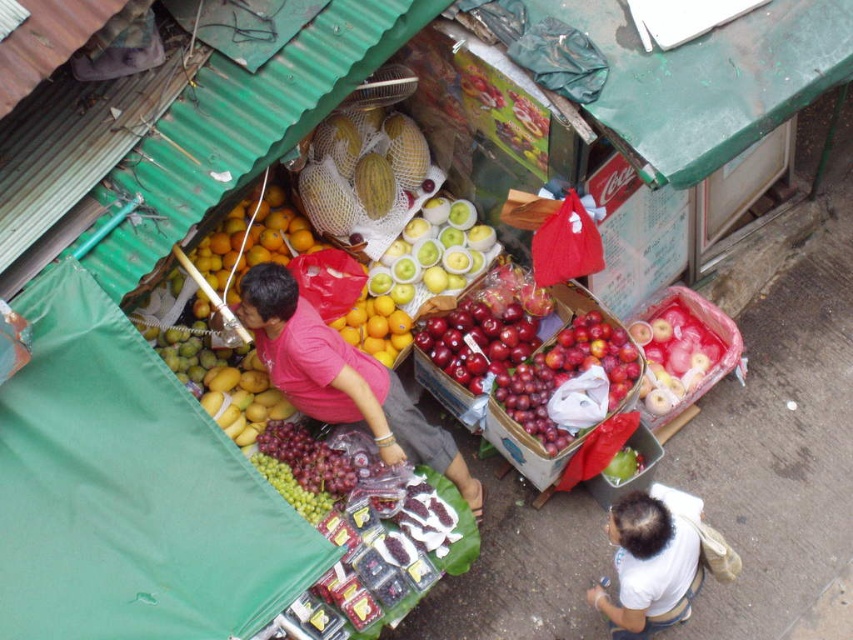
Question: Which of the following is the closest to the observer?

Choices:
 (A) (577, 371)
 (B) (383, 310)
 (C) (683, 604)

Answer: (C)

Question: Which object appears closest to the camera in this image?

Choices:
 (A) shiny red apples at center
 (B) smooth yellow oranges at center
 (C) yellow matte oranges at center
 (D) green netted melons at center

Answer: (A)

Question: Can you confirm if pink fabric shirt at center is positioned to the left of smooth yellow oranges at center?

Choices:
 (A) no
 (B) yes

Answer: (A)

Question: Which object is closer to the camera taking this photo?

Choices:
 (A) shiny red apples at center
 (B) smooth yellow oranges at center
 (C) yellow matte oranges at center
 (D) green netted melons at center

Answer: (A)

Question: Is white matte shirt at lower right thinner than smooth yellow oranges at center?

Choices:
 (A) no
 (B) yes

Answer: (A)

Question: Does yellow matte oranges at center come behind smooth yellow oranges at center?

Choices:
 (A) yes
 (B) no

Answer: (B)